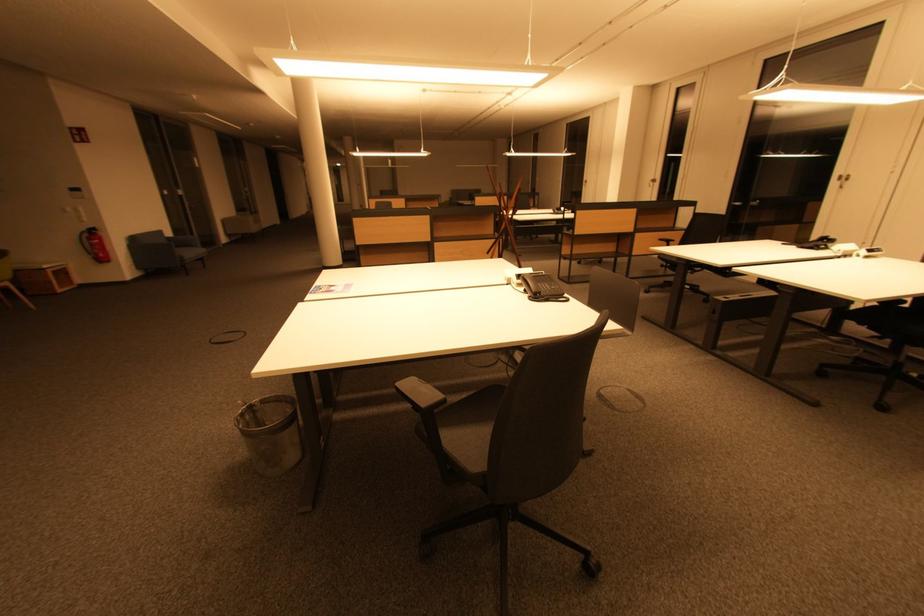
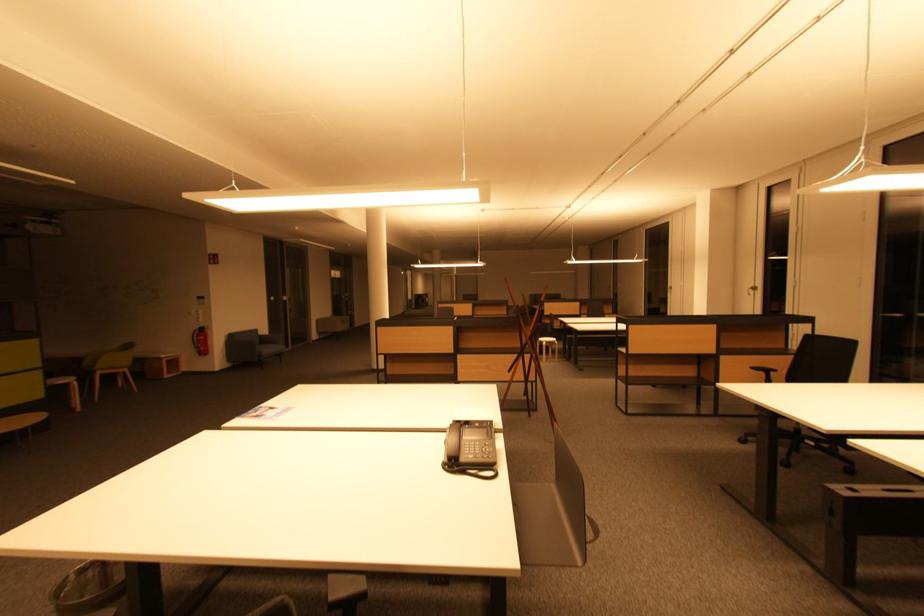
In the second image, find the point that corresponds to [670,245] in the first image.

(767, 376)